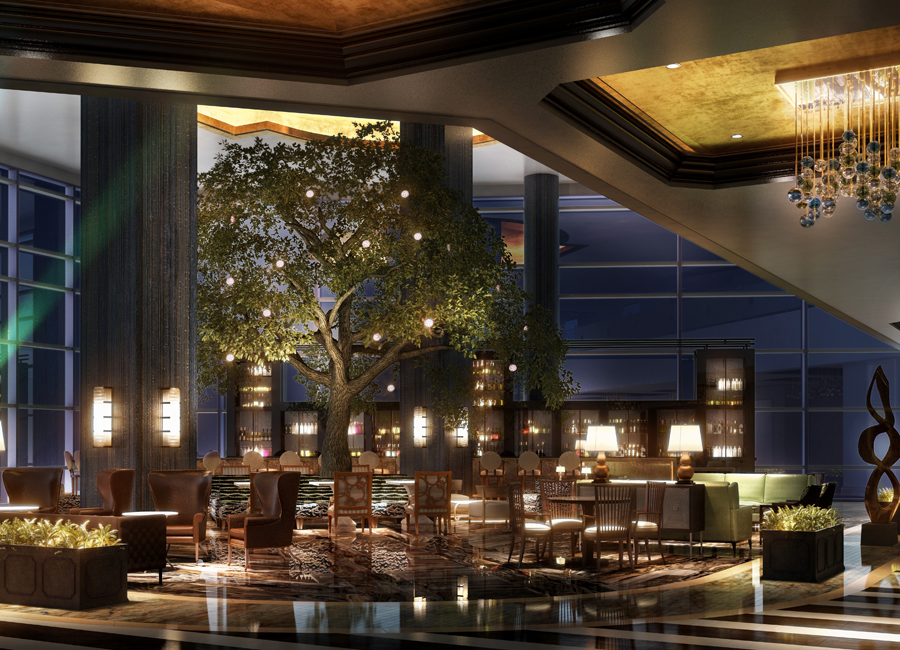
You are a GUI agent. You are given a task and a screenshot of the screen. Output one action in this format:
    pyautogui.click(x=<x>, y=<y>)
    Task: Click on the couches
    
    Given the screenshot: What is the action you would take?
    pyautogui.click(x=724, y=500), pyautogui.click(x=757, y=487)